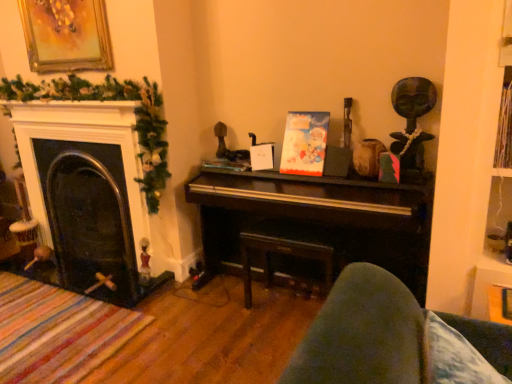
What is the approximate height of black glass fireplace at left?

black glass fireplace at left is 35.57 inches tall.

Where is `shiny dark wood piano at center`? Image resolution: width=512 pixels, height=384 pixels. shiny dark wood piano at center is located at coordinates 312,225.

Identify the location of velvet blue cushion at lower right. (393, 339).

What do you see at coordinates (66, 35) in the screenshot? The image size is (512, 384). I see `gold-framed painting at upper left` at bounding box center [66, 35].

You are a GUI agent. You are given a task and a screenshot of the screen. Output one action in this format:
    pyautogui.click(x=<x>, y=<y>)
    Task: Click on the black glass fireplace at left
    This screenshot has width=512, height=384.
    Given the screenshot: What is the action you would take?
    (86, 190)

Is point (138, 184) more distant than point (237, 232)?

That is False.

Is black glass fireplace at left facing towards shiny dark wood piano at center?

No, black glass fireplace at left is not turned towards shiny dark wood piano at center.

Are black glass fireplace at left and shiny dark wood piano at center far apart?

They are positioned close to each other.

Considering the relative positions of black glass fireplace at left and shiny dark wood piano at center in the image provided, is black glass fireplace at left to the left or to the right of shiny dark wood piano at center?

In the image, black glass fireplace at left appears on the left side of shiny dark wood piano at center.

From the image's perspective, which is above, velvet blue cushion at lower right or dark wood table at center?

dark wood table at center is shown above in the image.

Image resolution: width=512 pixels, height=384 pixels. I want to click on table above the velvet blue cushion at lower right (from the image's perspective), so click(x=285, y=249).

Is dark wood table at center completely or partially inside velvet blue cushion at lower right?

Actually, dark wood table at center is outside velvet blue cushion at lower right.

Is velvet blue cushion at lower right next to dark wood table at center?

No, velvet blue cushion at lower right is not making contact with dark wood table at center.

From a real-world perspective, who is located higher, shiny dark wood piano at center or gold-framed painting at upper left?

gold-framed painting at upper left, from a real-world perspective.

Considering the positions of objects shiny dark wood piano at center and gold-framed painting at upper left in the image provided, who is behind, shiny dark wood piano at center or gold-framed painting at upper left?

Result: gold-framed painting at upper left is further from the camera.

In the scene shown: Is shiny dark wood piano at center looking in the opposite direction of gold-framed painting at upper left?

No, shiny dark wood piano at center is not facing the opposite direction of gold-framed painting at upper left.

Which object is positioned more to the left, shiny dark wood piano at center or gold-framed painting at upper left?

gold-framed painting at upper left is more to the left.

Between shiny dark wood piano at center and velvet blue cushion at lower right, which one has larger width?

shiny dark wood piano at center is wider.

Is shiny dark wood piano at center bigger or smaller than velvet blue cushion at lower right?

In the image, shiny dark wood piano at center appears to be larger than velvet blue cushion at lower right.

How distant is shiny dark wood piano at center from velvet blue cushion at lower right?

shiny dark wood piano at center and velvet blue cushion at lower right are 1.01 meters apart.

Does shiny dark wood piano at center appear on the left side of velvet blue cushion at lower right?

Indeed, shiny dark wood piano at center is positioned on the left side of velvet blue cushion at lower right.

Are velvet blue cushion at lower right and gold-framed painting at upper left far apart?

Yes, velvet blue cushion at lower right and gold-framed painting at upper left are quite far apart.

At what (x,y) coordinates should I click in order to perform the action: click on rocking chair below the gold-framed painting at upper left (from a real-world perspective). Please return your answer as a coordinate pair (x, y). Looking at the image, I should click on (393, 339).

Is velvet blue cushion at lower right located outside gold-framed painting at upper left?

Yes, velvet blue cushion at lower right is not within gold-framed painting at upper left.

From their relative heights in the image, would you say velvet blue cushion at lower right is taller or shorter than gold-framed painting at upper left?

velvet blue cushion at lower right is shorter than gold-framed painting at upper left.

Which object is positioned more to the right, gold-framed painting at upper left or velvet blue cushion at lower right?

Positioned to the right is velvet blue cushion at lower right.

Between gold-framed painting at upper left and velvet blue cushion at lower right, which one is positioned in front?

Positioned in front is velvet blue cushion at lower right.

From a real-world perspective, is gold-framed painting at upper left physically located above or below velvet blue cushion at lower right?

gold-framed painting at upper left is above velvet blue cushion at lower right.

Based on the photo, is black glass fireplace at left facing away from gold-framed painting at upper left?

No, black glass fireplace at left's orientation is not away from gold-framed painting at upper left.

Which point is more forward, [106,138] or [50,0]?

Point [106,138]

Is black glass fireplace at left to the left of gold-framed painting at upper left from the viewer's perspective?

No, black glass fireplace at left is not to the left of gold-framed painting at upper left.

Between black glass fireplace at left and gold-framed painting at upper left, which one has smaller width?

With smaller width is gold-framed painting at upper left.

The width and height of the screenshot is (512, 384). I want to click on fireplace behind the shiny dark wood piano at center, so click(x=86, y=190).

This screenshot has height=384, width=512. I want to click on rocking chair lying below the dark wood table at center (from the image's perspective), so click(x=393, y=339).

Which object lies nearer to the anchor point dark wood table at center, shiny dark wood piano at center or gold-framed painting at upper left?

shiny dark wood piano at center.

From the image, which object appears to be farther from dark wood table at center, velvet blue cushion at lower right or black glass fireplace at left?

The object further to dark wood table at center is velvet blue cushion at lower right.

Looking at the image, which one is located further to shiny dark wood piano at center, black glass fireplace at left or dark wood table at center?

black glass fireplace at left is further to shiny dark wood piano at center.

Estimate the real-world distances between objects in this image. Which object is further from black glass fireplace at left, gold-framed painting at upper left or dark wood table at center?

Based on the image, dark wood table at center appears to be further to black glass fireplace at left.

Estimate the real-world distances between objects in this image. Which object is further from shiny dark wood piano at center, dark wood table at center or velvet blue cushion at lower right?

velvet blue cushion at lower right.

Looking at the image, which one is located further to dark wood table at center, gold-framed painting at upper left or velvet blue cushion at lower right?

Among the two, gold-framed painting at upper left is located further to dark wood table at center.

Based on their spatial positions, is black glass fireplace at left or dark wood table at center further from gold-framed painting at upper left?

dark wood table at center lies further to gold-framed painting at upper left than the other object.

When comparing their distances from velvet blue cushion at lower right, does gold-framed painting at upper left or dark wood table at center seem further?

Among the two, gold-framed painting at upper left is located further to velvet blue cushion at lower right.

Where is `fireplace situated between gold-framed painting at upper left and shiny dark wood piano at center from left to right`? The width and height of the screenshot is (512, 384). fireplace situated between gold-framed painting at upper left and shiny dark wood piano at center from left to right is located at coordinates (86, 190).

Where is `piano positioned between velvet blue cushion at lower right and dark wood table at center from near to far`? piano positioned between velvet blue cushion at lower right and dark wood table at center from near to far is located at coordinates (312, 225).

You are a GUI agent. You are given a task and a screenshot of the screen. Output one action in this format:
    pyautogui.click(x=<x>, y=<y>)
    Task: Click on the table between black glass fireplace at left and shiny dark wood piano at center
    The height and width of the screenshot is (384, 512).
    Given the screenshot: What is the action you would take?
    pyautogui.click(x=285, y=249)

You are a GUI agent. You are given a task and a screenshot of the screen. Output one action in this format:
    pyautogui.click(x=<x>, y=<y>)
    Task: Click on the piano between gold-framed painting at upper left and velvet blue cushion at lower right from left to right
    The image size is (512, 384).
    Given the screenshot: What is the action you would take?
    pyautogui.click(x=312, y=225)